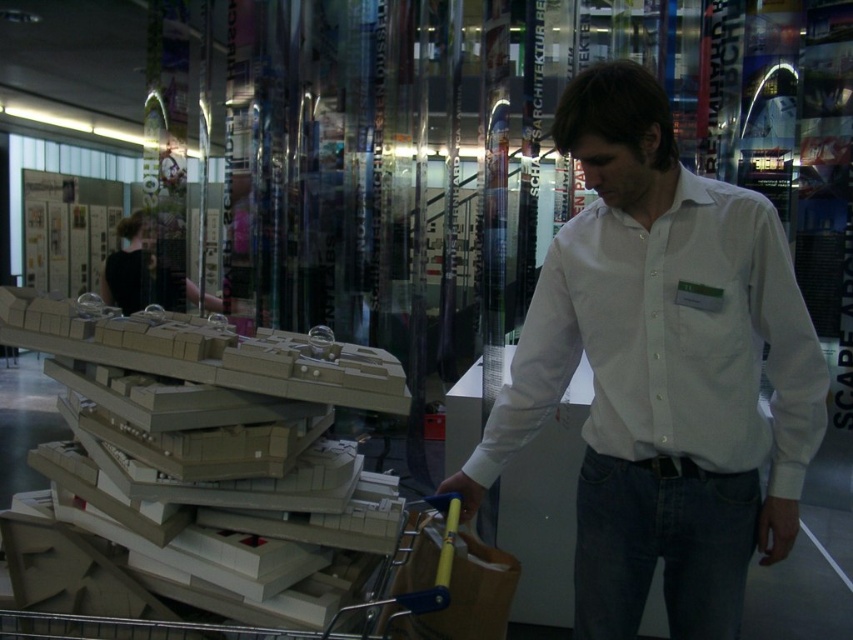
Question: Where is white cotton shirt at center located in relation to beige cardboard stack at center in the image?

Choices:
 (A) below
 (B) above

Answer: (B)

Question: Among these objects, which one is farthest from the camera?

Choices:
 (A) beige cardboard stack at center
 (B) white cotton shirt at center

Answer: (B)

Question: Which point is farther to the camera?

Choices:
 (A) (689, 449)
 (B) (376, 506)

Answer: (B)

Question: Can you confirm if white cotton shirt at center is thinner than beige cardboard stack at center?

Choices:
 (A) yes
 (B) no

Answer: (A)

Question: Is white cotton shirt at center wider than beige cardboard stack at center?

Choices:
 (A) yes
 (B) no

Answer: (B)